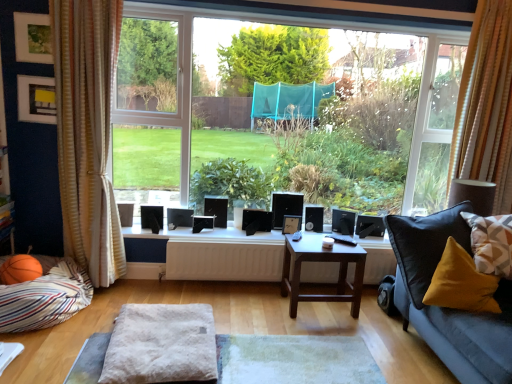
Question: Does white glossy window sill at center touch striped fabric pillow at lower left, arranged as the third pillow when viewed from the right?

Choices:
 (A) no
 (B) yes

Answer: (A)

Question: From a real-world perspective, is white glossy window sill at center on striped fabric pillow at lower left, arranged as the third pillow when viewed from the right?

Choices:
 (A) no
 (B) yes

Answer: (B)

Question: Is white glossy window sill at center positioned behind striped fabric pillow at lower left, which ranks as the first pillow in left-to-right order?

Choices:
 (A) yes
 (B) no

Answer: (A)

Question: From the image's perspective, is white glossy window sill at center located above striped fabric pillow at lower left, arranged as the third pillow when viewed from the right?

Choices:
 (A) yes
 (B) no

Answer: (A)

Question: Does white glossy window sill at center have a greater width compared to striped fabric pillow at lower left, which ranks as the first pillow in left-to-right order?

Choices:
 (A) yes
 (B) no

Answer: (B)

Question: From a real-world perspective, is white glossy window sill at center below striped fabric pillow at lower left, arranged as the third pillow when viewed from the right?

Choices:
 (A) yes
 (B) no

Answer: (B)

Question: Is wooden picture frame at center, the third picture frame viewed from the front, to the right of striped fabric pillow at lower left, which ranks as the first pillow in left-to-right order, from the viewer's perspective?

Choices:
 (A) no
 (B) yes

Answer: (B)

Question: Can you confirm if wooden picture frame at center, placed as the third picture frame when sorted from left to right, is wider than striped fabric pillow at lower left, which ranks as the first pillow in left-to-right order?

Choices:
 (A) yes
 (B) no

Answer: (B)

Question: From the image's perspective, does wooden picture frame at center, the third picture frame viewed from the front, appear lower than striped fabric pillow at lower left, which ranks as the first pillow in left-to-right order?

Choices:
 (A) no
 (B) yes

Answer: (A)

Question: Is wooden picture frame at center, the 3th picture frame when ordered from top to bottom, positioned behind striped fabric pillow at lower left, arranged as the third pillow when viewed from the right?

Choices:
 (A) no
 (B) yes

Answer: (B)

Question: Can you confirm if wooden picture frame at center, arranged as the 1th picture frame when ordered from the bottom, is taller than striped fabric pillow at lower left, arranged as the third pillow when viewed from the right?

Choices:
 (A) yes
 (B) no

Answer: (B)

Question: Does wooden picture frame at center, placed as the third picture frame when sorted from left to right, have a lesser width compared to striped fabric pillow at lower left, which ranks as the first pillow in left-to-right order?

Choices:
 (A) yes
 (B) no

Answer: (A)

Question: Is matte black picture frame at upper left, arranged as the 2th picture frame when viewed from the back, to the right of fuzzy fabric ottoman at center from the viewer's perspective?

Choices:
 (A) yes
 (B) no

Answer: (B)